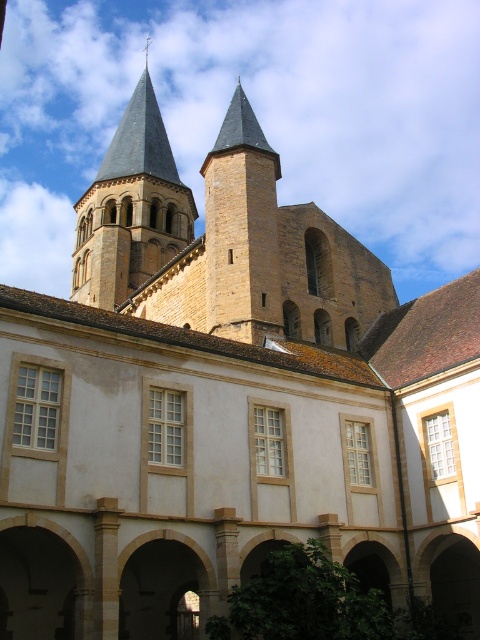
This screenshot has height=640, width=480. What do you see at coordinates (131, 208) in the screenshot? I see `smooth gray steeple at upper center` at bounding box center [131, 208].

Based on the photo, is smooth gray steeple at upper center to the left of smooth stone tower at center from the viewer's perspective?

Yes, smooth gray steeple at upper center is to the left of smooth stone tower at center.

Is point (182, 216) positioned before point (242, 282)?

No, (182, 216) is behind (242, 282).

Locate an element on the screen. smooth gray steeple at upper center is located at coordinates click(x=131, y=208).